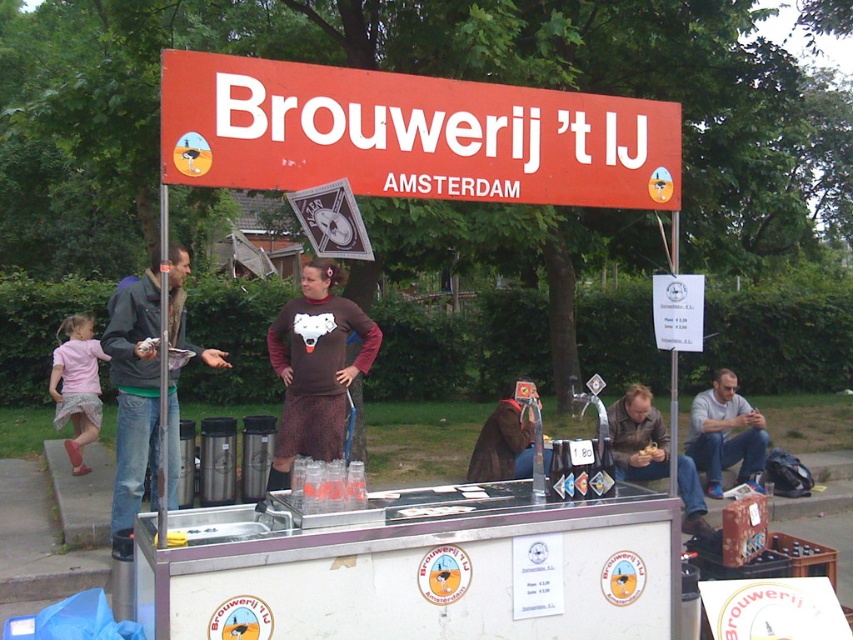
You are a customer standing in front of the beer stand. You want to place an order. Which object should you approach first, the metallic silver food truck at center or the red plastic sign at upper center?

You should approach the metallic silver food truck at center first because it is to the left of the red plastic sign at upper center, making it closer to you as you face the stand.

You are standing at the point with coordinates point (416, 566) in the scene. What object are you standing on?

The point (416, 566) corresponds to the metallic silver food truck at center.

You are a customer standing in front of the metallic silver food truck at center and the jeans jacket at left. Which object is positioned lower from the ground?

The metallic silver food truck at center is positioned lower from the ground than the jeans jacket at left.